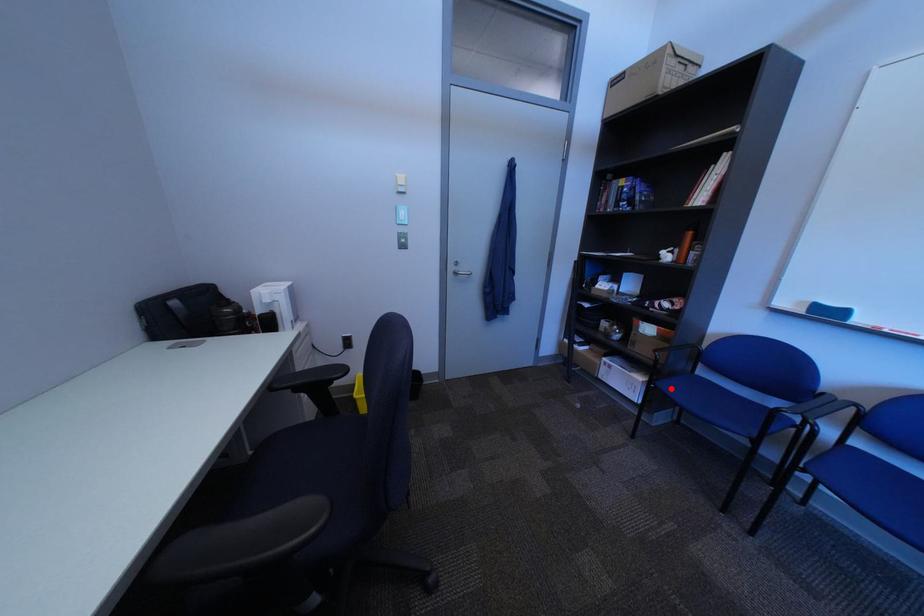
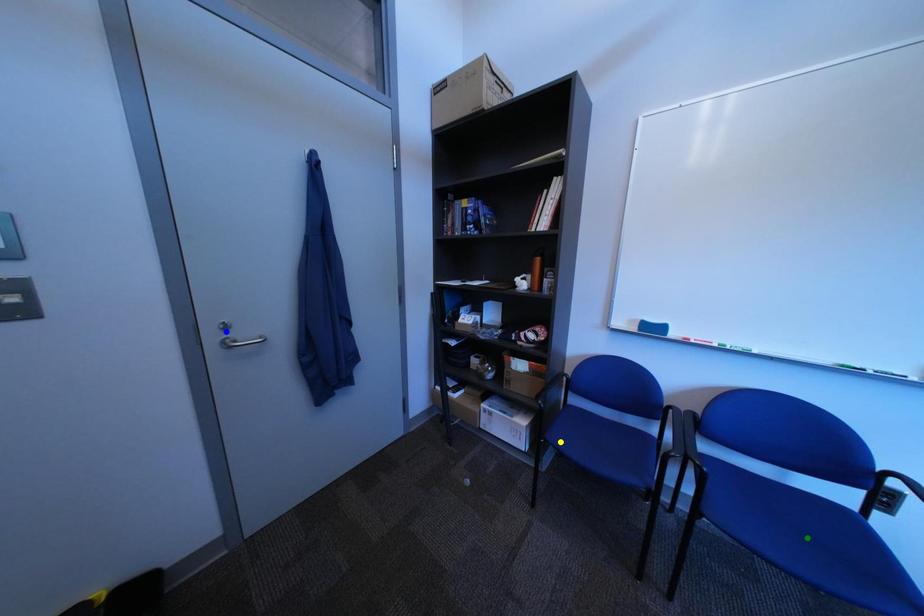
Question: I am providing you with two images of the same scene from different viewpoints. A red point is marked on the first image. You are given multiple points on the second image. Which point in image 2 represents the same 3d spot as the red point in image 1?

Choices:
 (A) yellow point
 (B) green point
 (C) blue point

Answer: (A)